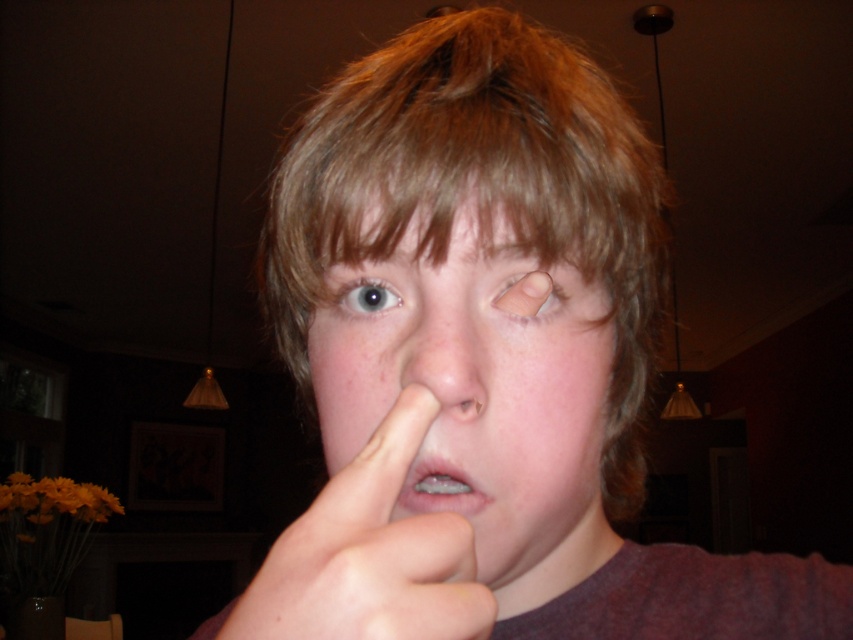
Question: Which point is closer to the camera taking this photo?

Choices:
 (A) (438, 413)
 (B) (604, 106)

Answer: (A)

Question: Among these objects, which one is farthest from the camera?

Choices:
 (A) brown matte eyebrow at upper center
 (B) clear plastic braces at center
 (C) pale skin at center

Answer: (B)

Question: Which point appears farthest from the camera in this image?

Choices:
 (A) (386, 307)
 (B) (548, 195)

Answer: (A)

Question: Does light brown hair at center have a larger size compared to matte skin at center?

Choices:
 (A) no
 (B) yes

Answer: (B)

Question: Does matte skin at center have a smaller size compared to blue glossy eye at center?

Choices:
 (A) yes
 (B) no

Answer: (B)

Question: Does pale skin at center have a smaller size compared to blue glossy eye at center?

Choices:
 (A) no
 (B) yes

Answer: (A)